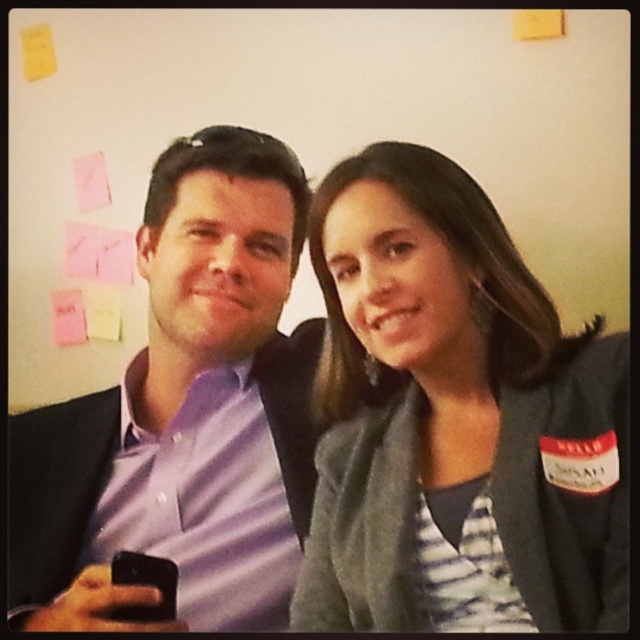
You are standing in the room and want to hand a document to the gray fabric jacket at upper right. Where should you approach to deliver it?

The gray fabric jacket at upper right is located at point (x=456, y=420), so you should approach the area corresponding to those coordinates to deliver the document.